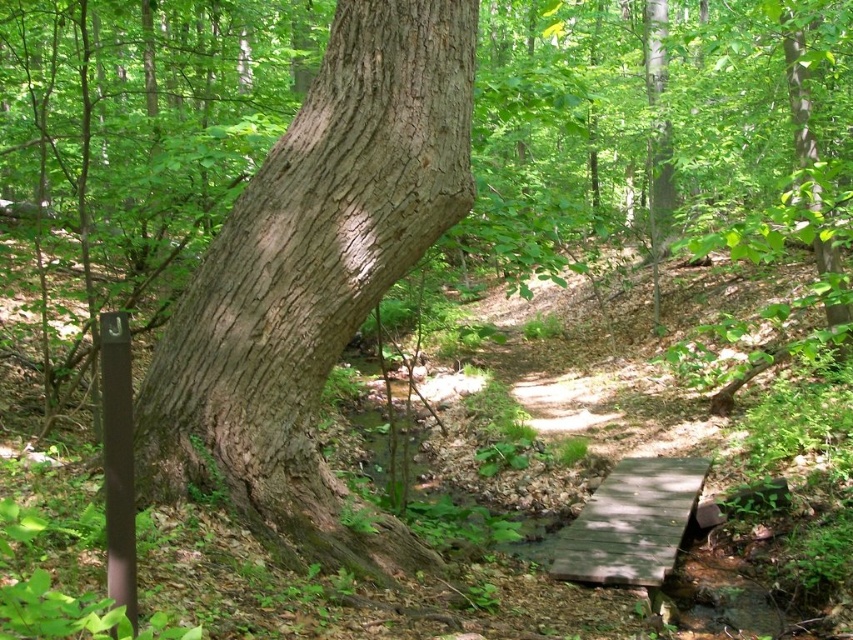
Who is positioned more to the right, brown rough bark tree trunk at center or wooden bridge at center?

wooden bridge at center is more to the right.

Is brown rough bark tree trunk at center to the right of wooden bridge at center from the viewer's perspective?

In fact, brown rough bark tree trunk at center is to the left of wooden bridge at center.

Is point (387, 20) farther from camera compared to point (561, 563)?

No.

Where is `brown rough bark tree trunk at center`? brown rough bark tree trunk at center is located at coordinates (314, 280).